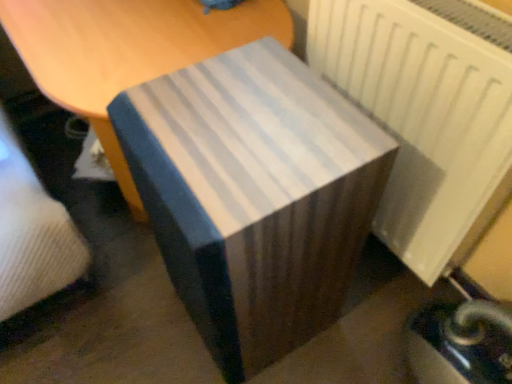
Question: Should I look upward or downward to see white matte radiator at right?

Choices:
 (A) down
 (B) up

Answer: (B)

Question: Is blue striped fabric at center completely or partially outside of white striped fabric at center?

Choices:
 (A) no
 (B) yes

Answer: (B)

Question: Does blue striped fabric at center come in front of white striped fabric at center?

Choices:
 (A) yes
 (B) no

Answer: (A)

Question: Is blue striped fabric at center next to white striped fabric at center?

Choices:
 (A) no
 (B) yes

Answer: (A)

Question: From the image's perspective, does blue striped fabric at center appear lower than white striped fabric at center?

Choices:
 (A) no
 (B) yes

Answer: (B)

Question: Does blue striped fabric at center have a smaller size compared to white striped fabric at center?

Choices:
 (A) yes
 (B) no

Answer: (A)

Question: Is blue striped fabric at center far away from white striped fabric at center?

Choices:
 (A) yes
 (B) no

Answer: (B)

Question: From a real-world perspective, is white striped fabric at center physically below white matte radiator at right?

Choices:
 (A) no
 (B) yes

Answer: (B)

Question: Is the depth of white striped fabric at center greater than that of white matte radiator at right?

Choices:
 (A) yes
 (B) no

Answer: (A)

Question: Can we say white striped fabric at center lies outside white matte radiator at right?

Choices:
 (A) yes
 (B) no

Answer: (A)

Question: Does white striped fabric at center touch white matte radiator at right?

Choices:
 (A) yes
 (B) no

Answer: (B)

Question: From a real-world perspective, is white striped fabric at center on white matte radiator at right?

Choices:
 (A) no
 (B) yes

Answer: (A)

Question: Considering the relative sizes of white striped fabric at center and white matte radiator at right in the image provided, is white striped fabric at center wider than white matte radiator at right?

Choices:
 (A) no
 (B) yes

Answer: (B)

Question: From a real-world perspective, is blue striped fabric at center positioned over white matte radiator at right based on gravity?

Choices:
 (A) yes
 (B) no

Answer: (B)